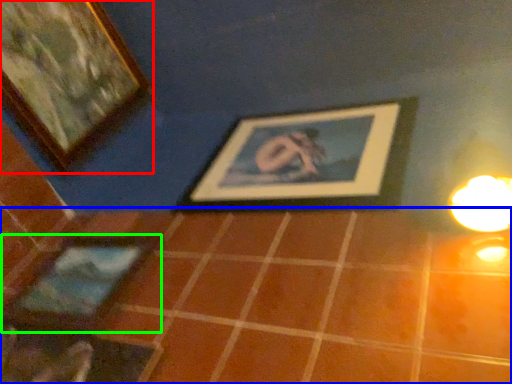
Question: Based on their relative distances, which object is nearer to picture frame (highlighted by a red box)? Choose from tile (highlighted by a blue box) and picture frame (highlighted by a green box).

Choices:
 (A) tile
 (B) picture frame

Answer: (B)